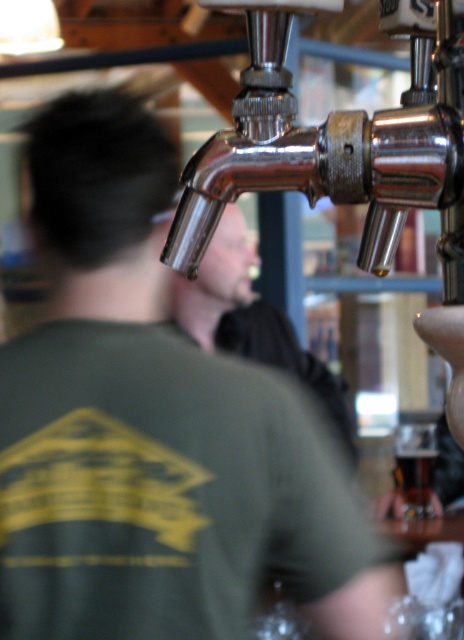
Does chrome metallic faucet at upper center have a greater width compared to shiny metallic faucet at center?

No, chrome metallic faucet at upper center is not wider than shiny metallic faucet at center.

Can you confirm if chrome metallic faucet at upper center is positioned below shiny metallic faucet at center?

No.

The image size is (464, 640). Find the location of `chrome metallic faucet at upper center`. chrome metallic faucet at upper center is located at coordinates (339, 141).

Who is lower down, chrome metallic faucet at upper center or translucent glass at center?

translucent glass at center

Is point (205, 230) positioned behind point (420, 490)?

No, (205, 230) is closer to viewer.

In the scene shown: Who is more distant from viewer, [279,61] or [406,484]?

Point [406,484]

Where is `chrome metallic faucet at upper center`? chrome metallic faucet at upper center is located at coordinates (339, 141).

Between shiny metallic faucet at center and translucent glass at center, which one is positioned lower?

translucent glass at center is below.

Does point (294, 365) lie in front of point (423, 460)?

No, it is behind (423, 460).

Locate an element on the screen. The height and width of the screenshot is (640, 464). shiny metallic faucet at center is located at coordinates (251, 320).